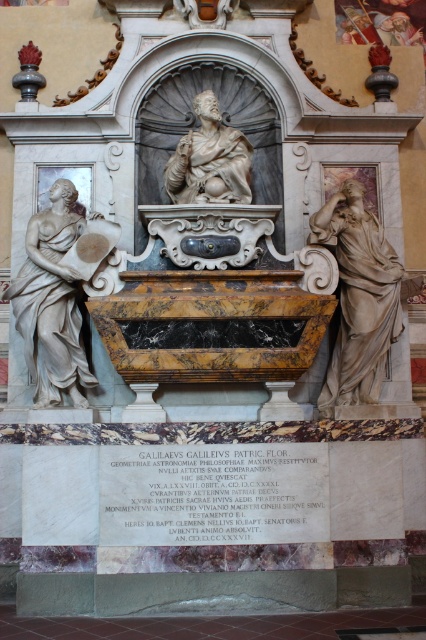
You are an art student analyzing the monument. You observe the white marble statue at left and the marble statue at center. Which statue is taller?

The white marble statue at left is much taller than the marble statue at center.

You are an art student analyzing the monument. You observe the matte white statue at right and the marble statue at center. Which statue is positioned lower in the monument?

The matte white statue at right is positioned lower because it is below the marble statue at center.

You are a visitor standing in front of the monument. You notice two statues, the matte white statue at right and the white marble statue at left. Which statue is closer to you?

The matte white statue at right is closer to you because it is further to the viewer than the white marble statue at left.